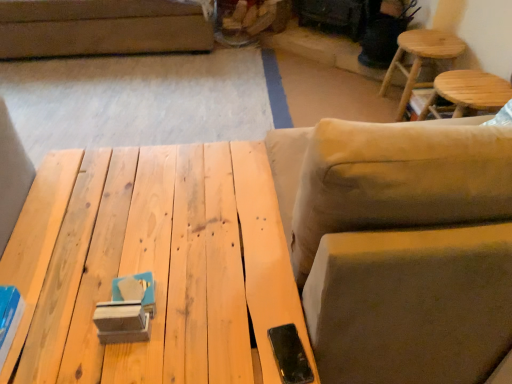
Question: From a real-world perspective, is wooden stool at upper right, which is the second stool in back-to-front order, on beige fabric swivel chair at right?

Choices:
 (A) no
 (B) yes

Answer: (A)

Question: Is wooden stool at upper right, which is counted as the first stool, starting from the front, at the left side of beige fabric swivel chair at right?

Choices:
 (A) no
 (B) yes

Answer: (A)

Question: From the image's perspective, would you say wooden stool at upper right, which is the second stool in back-to-front order, is shown under beige fabric swivel chair at right?

Choices:
 (A) yes
 (B) no

Answer: (B)

Question: Could beige fabric swivel chair at right be considered to be inside wooden stool at upper right, which is counted as the first stool, starting from the front?

Choices:
 (A) no
 (B) yes

Answer: (A)

Question: Considering the relative sizes of wooden stool at upper right, which is the second stool in back-to-front order, and beige fabric swivel chair at right in the image provided, is wooden stool at upper right, which is the second stool in back-to-front order, shorter than beige fabric swivel chair at right?

Choices:
 (A) no
 (B) yes

Answer: (B)

Question: In terms of width, does natural wood table at center look wider or thinner when compared to beige fabric swivel chair at right?

Choices:
 (A) thin
 (B) wide

Answer: (B)

Question: From a real-world perspective, is natural wood table at center above or below beige fabric swivel chair at right?

Choices:
 (A) above
 (B) below

Answer: (B)

Question: Is natural wood table at center inside the boundaries of beige fabric swivel chair at right, or outside?

Choices:
 (A) outside
 (B) inside

Answer: (A)

Question: Is natural wood table at center taller or shorter than beige fabric swivel chair at right?

Choices:
 (A) tall
 (B) short

Answer: (B)

Question: Considering the positions of wooden stool at upper right, which is the second stool in back-to-front order, and natural wood table at center in the image, is wooden stool at upper right, which is the second stool in back-to-front order, bigger or smaller than natural wood table at center?

Choices:
 (A) small
 (B) big

Answer: (A)

Question: Considering the positions of wooden stool at upper right, which is the second stool in back-to-front order, and natural wood table at center in the image, is wooden stool at upper right, which is the second stool in back-to-front order, taller or shorter than natural wood table at center?

Choices:
 (A) short
 (B) tall

Answer: (A)

Question: From the image's perspective, is wooden stool at upper right, which is the second stool in back-to-front order, positioned above or below natural wood table at center?

Choices:
 (A) above
 (B) below

Answer: (A)

Question: From a real-world perspective, is wooden stool at upper right, which is the second stool in back-to-front order, positioned above or below natural wood table at center?

Choices:
 (A) below
 (B) above

Answer: (B)

Question: Is point (445, 44) positioned closer to the camera than point (394, 283)?

Choices:
 (A) farther
 (B) closer

Answer: (A)

Question: From the image's perspective, is light brown wooden stool at upper right, acting as the 2th stool starting from the front, located above or below beige fabric swivel chair at right?

Choices:
 (A) above
 (B) below

Answer: (A)